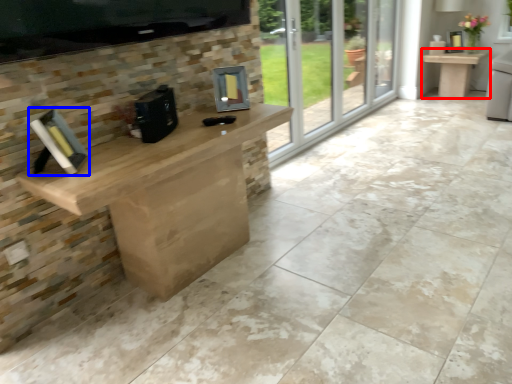
Question: Which point is closer to the camera, table (highlighted by a red box) or book (highlighted by a blue box)?

Choices:
 (A) table
 (B) book

Answer: (B)